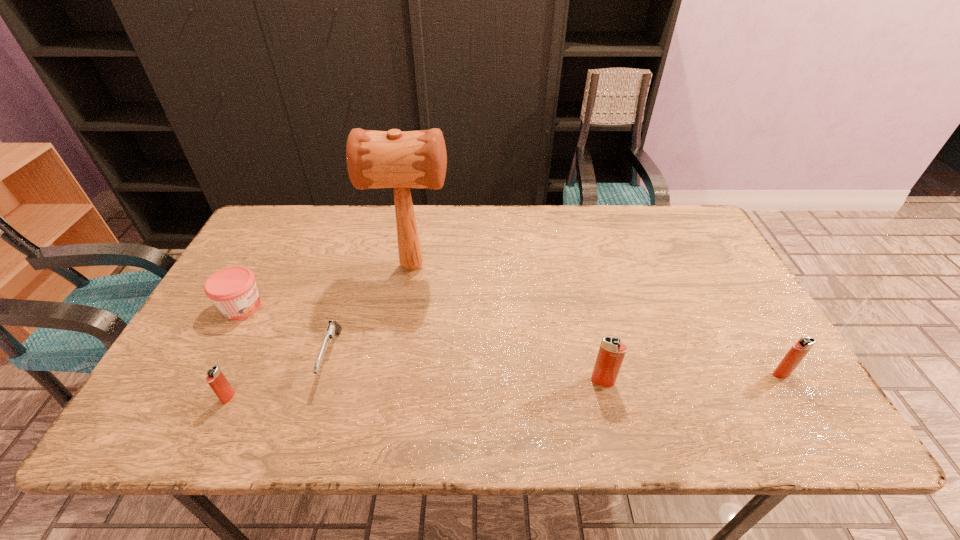
Where is `vacant position in the image that satisfies the following two spatial constraints: 1. on the back side of the fourth shortest object; 2. on the front label of the second farthest object`? The height and width of the screenshot is (540, 960). vacant position in the image that satisfies the following two spatial constraints: 1. on the back side of the fourth shortest object; 2. on the front label of the second farthest object is located at coordinates (742, 307).

You are a GUI agent. You are given a task and a screenshot of the screen. Output one action in this format:
    pyautogui.click(x=<x>, y=<y>)
    Task: Click on the blank space that satisfies the following two spatial constraints: 1. on the strike surface of the third object from right to left; 2. on the back side of the rightmost object
    This screenshot has width=960, height=540.
    Given the screenshot: What is the action you would take?
    pyautogui.click(x=395, y=374)

Identify the location of free location that satisfies the following two spatial constraints: 1. on the strike surface of the mallet; 2. on the right side of the tallest igniter. (393, 381).

At what (x,y) coordinates should I click in order to perform the action: click on vacant point that satisfies the following two spatial constraints: 1. on the front label of the leftmost object; 2. on the right side of the leftmost igniter. Please return your answer as a coordinate pair (x, y). Looking at the image, I should click on (193, 397).

Identify the location of free point that satisfies the following two spatial constraints: 1. on the strike surface of the fourth object from left to right; 2. on the front-facing side of the pistol. This screenshot has width=960, height=540. (397, 357).